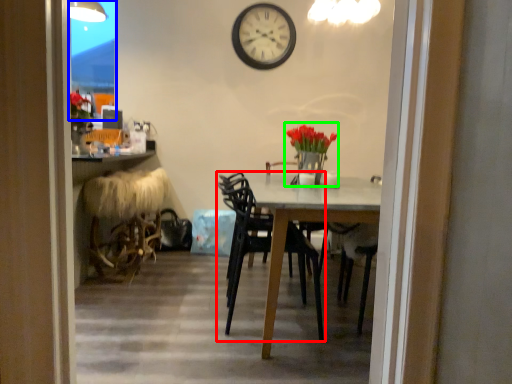
Question: Which is nearer to the chair (highlighted by a red box)? glass door (highlighted by a blue box) or floral arrangement (highlighted by a green box).

Choices:
 (A) glass door
 (B) floral arrangement

Answer: (B)